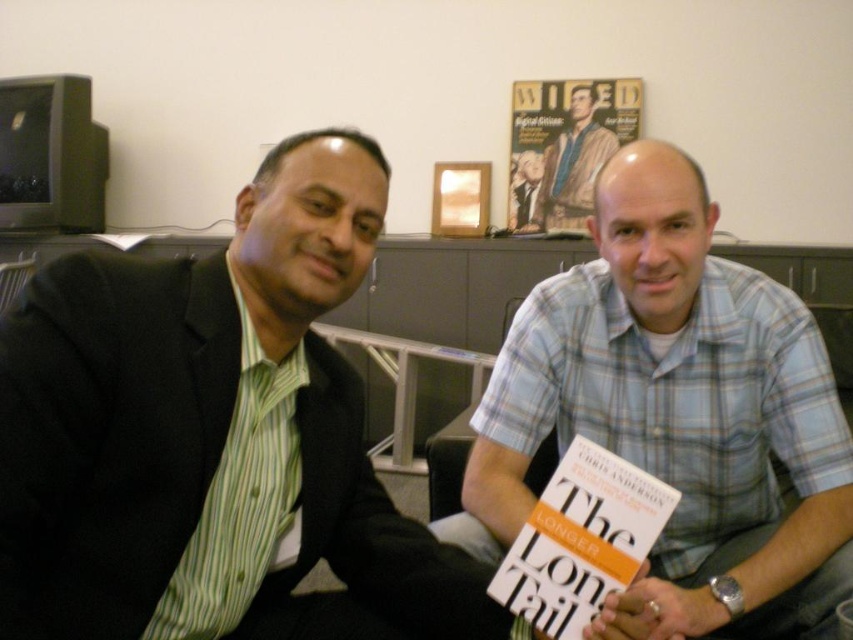
Who is positioned more to the left, matte black suit at left or light blue plaid shirt at center?

Positioned to the left is matte black suit at left.

Consider the image. Is matte black suit at left positioned in front of light blue plaid shirt at center?

Yes, it is.

Is point (213, 410) behind point (485, 486)?

That is False.

This screenshot has width=853, height=640. I want to click on matte black suit at left, so click(210, 432).

Can you confirm if matte black suit at left is bigger than white paper book at center?

Correct, matte black suit at left is larger in size than white paper book at center.

Is point (3, 376) more distant than point (581, 538)?

No, it is not.

Identify the location of matte black suit at left. The width and height of the screenshot is (853, 640). (210, 432).

How distant is matte black suit at left from blue plaid shirt at center?

A distance of 7.39 feet exists between matte black suit at left and blue plaid shirt at center.

Does matte black suit at left have a greater width compared to blue plaid shirt at center?

Indeed, matte black suit at left has a greater width compared to blue plaid shirt at center.

Locate an element on the screen. This screenshot has width=853, height=640. matte black suit at left is located at coordinates (210, 432).